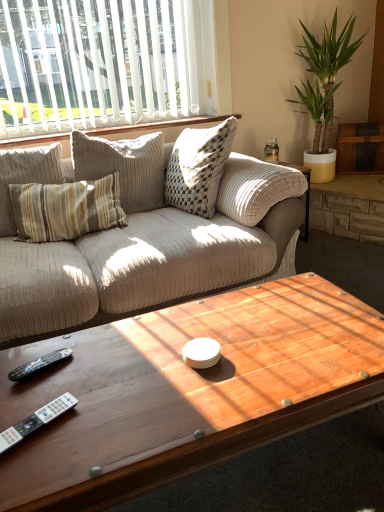
Question: Is white vertical blinds at upper left turned away from white textured pillows at upper center?

Choices:
 (A) yes
 (B) no

Answer: (B)

Question: Can you confirm if white vertical blinds at upper left is positioned to the right of white textured pillows at upper center?

Choices:
 (A) yes
 (B) no

Answer: (B)

Question: Does white vertical blinds at upper left have a greater width compared to white textured pillows at upper center?

Choices:
 (A) yes
 (B) no

Answer: (B)

Question: From a real-world perspective, does white vertical blinds at upper left stand above white textured pillows at upper center?

Choices:
 (A) no
 (B) yes

Answer: (B)

Question: From a real-world perspective, is white vertical blinds at upper left located beneath white textured pillows at upper center?

Choices:
 (A) no
 (B) yes

Answer: (A)

Question: Is white textured pillows at upper center surrounded by white vertical blinds at upper left?

Choices:
 (A) no
 (B) yes

Answer: (A)

Question: Does white vertical blinds at upper left have a larger size compared to wooden coffee table at center?

Choices:
 (A) no
 (B) yes

Answer: (A)

Question: From a real-world perspective, is white vertical blinds at upper left on top of wooden coffee table at center?

Choices:
 (A) no
 (B) yes

Answer: (B)

Question: Does white vertical blinds at upper left have a smaller size compared to wooden coffee table at center?

Choices:
 (A) no
 (B) yes

Answer: (B)

Question: Can you confirm if white vertical blinds at upper left is shorter than wooden coffee table at center?

Choices:
 (A) yes
 (B) no

Answer: (B)

Question: Is white vertical blinds at upper left completely or partially outside of wooden coffee table at center?

Choices:
 (A) yes
 (B) no

Answer: (A)

Question: Is white vertical blinds at upper left closer to camera compared to wooden coffee table at center?

Choices:
 (A) yes
 (B) no

Answer: (B)

Question: Are green leafy plant at upper right and black plastic remote at lower left far apart?

Choices:
 (A) yes
 (B) no

Answer: (A)